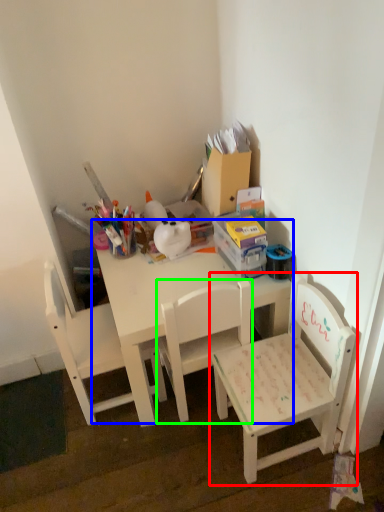
Question: Which object is positioned closest to chair (highlighted by a red box)? Select from table (highlighted by a blue box) and chair (highlighted by a green box).

Choices:
 (A) table
 (B) chair

Answer: (B)